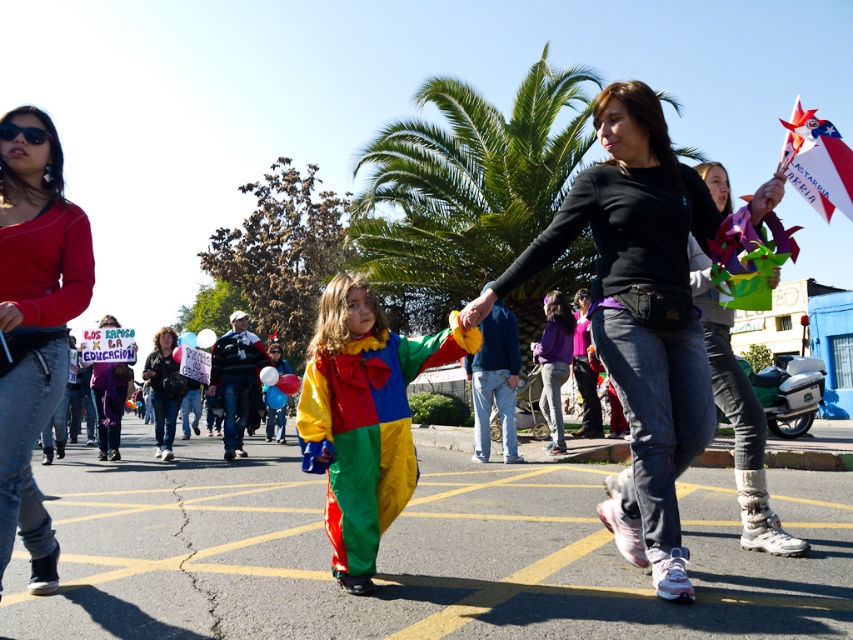
Question: Does matte clown costume at center have a greater width compared to multicolored fabric dress at center?

Choices:
 (A) yes
 (B) no

Answer: (A)

Question: Observing the image, what is the correct spatial positioning of matte clown costume at center in reference to multicolored fabric dress at center?

Choices:
 (A) left
 (B) right

Answer: (A)

Question: Which point is farther from the camera taking this photo?

Choices:
 (A) (804, 177)
 (B) (395, 490)

Answer: (A)

Question: Which of the following is the farthest from the observer?

Choices:
 (A) (737, 496)
 (B) (801, 141)
 (C) (158, 388)
 (D) (544, 352)

Answer: (C)

Question: Is matte black shirt at left smaller than purple matte shirt at center?

Choices:
 (A) yes
 (B) no

Answer: (B)

Question: Which is farther from the purple matte shirt at center?

Choices:
 (A) multicolored fabric dress at center
 (B) white paper flag at upper right

Answer: (B)